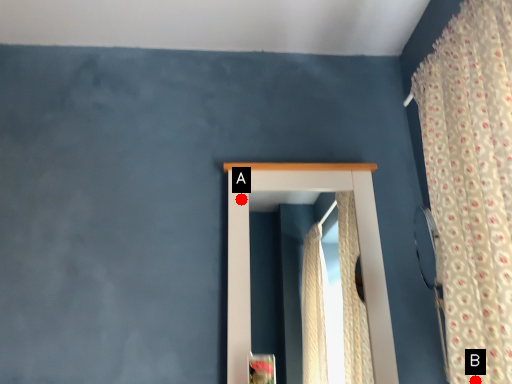
Question: Two points are circled on the image, labeled by A and B beside each circle. Which point is further to the camera?

Choices:
 (A) A is further
 (B) B is further

Answer: (A)